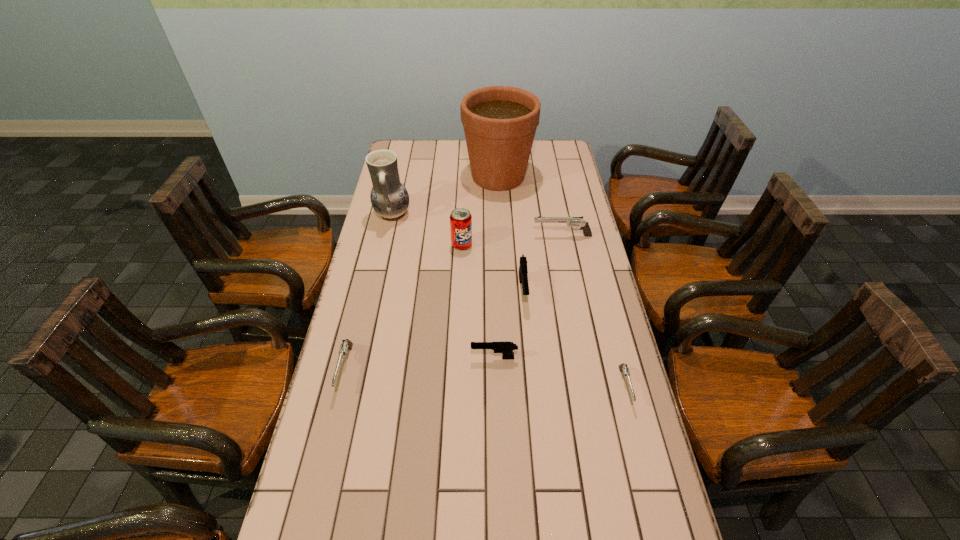
Locate an element on the screen. The height and width of the screenshot is (540, 960). unoccupied position between the leftmost pistol and the tallest object is located at coordinates (421, 273).

Identify the location of free point between the second pistol from left to right and the shortest pistol. Image resolution: width=960 pixels, height=540 pixels. (560, 372).

Identify the location of object identified as the fourth closest to the shortest pistol. This screenshot has width=960, height=540. (460, 218).

Locate which object is the sixth closest to the shortest object. Please provide its 2D coordinates. Your answer should be formatted as a tuple, i.e. [(x, y)], where the tuple contains the x and y coordinates of a point satisfying the conditions above.

[(500, 122)]

What are the coordinates of `pistol that is the fourth nearest to the second farthest object` in the screenshot? It's located at (506, 348).

Select which pistol appears as the closest to the leftmost pistol. Please provide its 2D coordinates. Your answer should be formatted as a tuple, i.e. [(x, y)], where the tuple contains the x and y coordinates of a point satisfying the conditions above.

[(506, 348)]

At what (x,y) coordinates should I click in order to perform the action: click on the closest silver pistol to the leftmost silver pistol. Please return your answer as a coordinate pair (x, y). This screenshot has height=540, width=960. Looking at the image, I should click on (570, 221).

Locate which silver pistol is the closest to the biggest silver pistol. Please provide its 2D coordinates. Your answer should be formatted as a tuple, i.e. [(x, y)], where the tuple contains the x and y coordinates of a point satisfying the conditions above.

[(623, 367)]

Where is `free region that satisfies the following two spatial constraints: 1. on the front-facing side of the biggest silver pistol; 2. on the front-facing side of the right black pistol`? This screenshot has width=960, height=540. free region that satisfies the following two spatial constraints: 1. on the front-facing side of the biggest silver pistol; 2. on the front-facing side of the right black pistol is located at coordinates (573, 290).

Locate an element on the screen. The width and height of the screenshot is (960, 540). free space in the image that satisfies the following two spatial constraints: 1. on the front-facing side of the nearer black pistol; 2. on the front-facing side of the leftmost silver pistol is located at coordinates (494, 369).